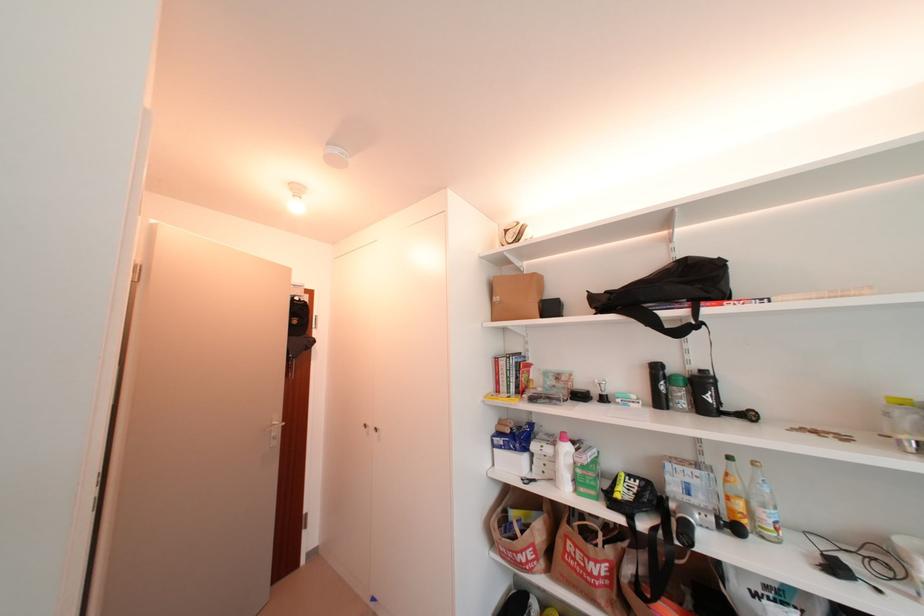
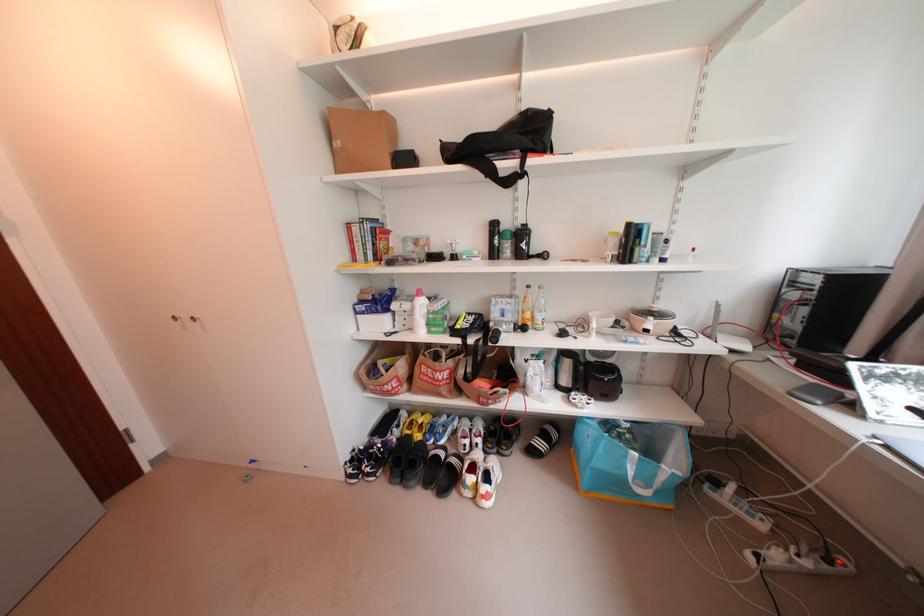
In the second image, find the point that corresponds to pixel 685 307 in the first image.

(518, 158)